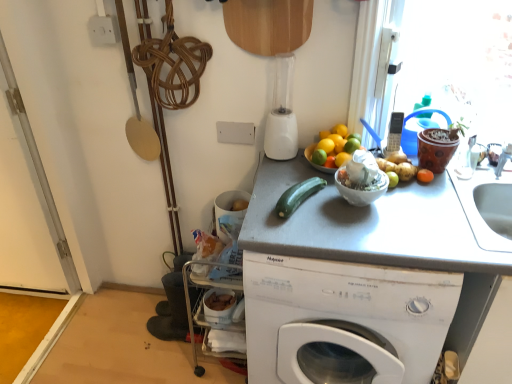
At what (x,y) coordinates should I click in order to perform the action: click on free region on the left part of green smooth-textured zucchini at center. Please return your answer as a coordinate pair (x, y). Image resolution: width=512 pixels, height=384 pixels. Looking at the image, I should click on (262, 206).